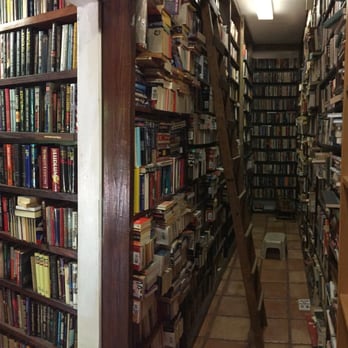
In order to click on ladder in this screenshot , I will do `click(250, 270)`.